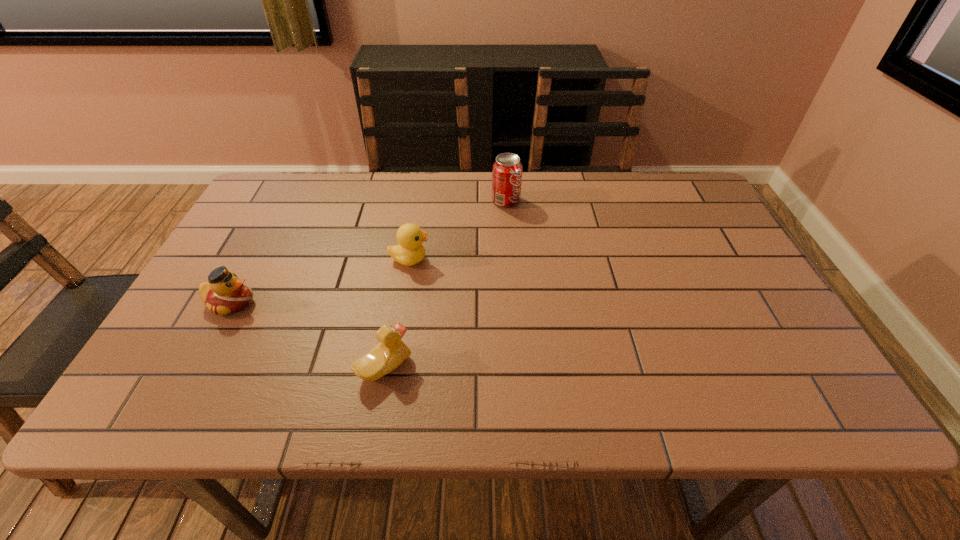
Image resolution: width=960 pixels, height=540 pixels. Identify the location of object that is at the far edge. (507, 169).

Identify the location of object present at the near edge. (391, 351).

Locate an element on the screen. The height and width of the screenshot is (540, 960). object present at the left edge is located at coordinates click(x=225, y=293).

Where is `vacant point at the far edge`? vacant point at the far edge is located at coordinates (404, 211).

Image resolution: width=960 pixels, height=540 pixels. Identify the location of vacant region at the near edge of the desktop. (389, 409).

The image size is (960, 540). Find the location of `free spot at the left edge of the desktop`. free spot at the left edge of the desktop is located at coordinates (237, 254).

You are a GUI agent. You are given a task and a screenshot of the screen. Output one action in this format:
    pyautogui.click(x=<x>, y=<y>)
    Task: Click on the vacant space at the right edge of the desktop
    
    Given the screenshot: What is the action you would take?
    pyautogui.click(x=716, y=307)

Locate an element on the screen. Image resolution: width=960 pixels, height=540 pixels. free spot at the far left corner of the desktop is located at coordinates (283, 215).

In the image, there is a desktop. In order to click on vacant space at the near left corner in this screenshot , I will do `click(205, 386)`.

Where is `vacant region at the far right corner`? The image size is (960, 540). vacant region at the far right corner is located at coordinates (672, 203).